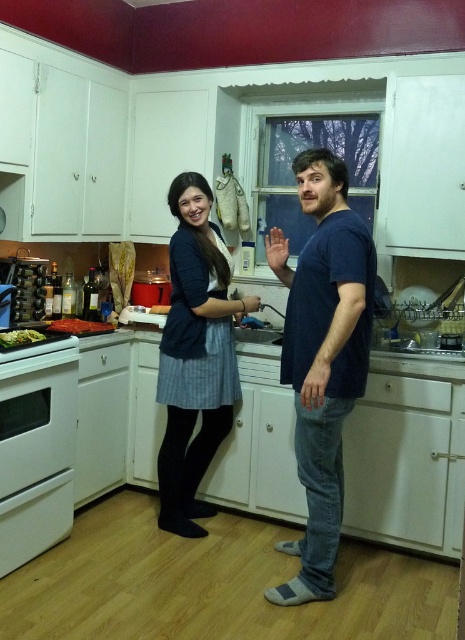
You are trying to determine which object is taller between the red matte pizza at lower left and the green leafy vegetables at stove front. Based on the scene, which one is taller?

The red matte pizza at lower left is taller than the green leafy vegetables at stove front.